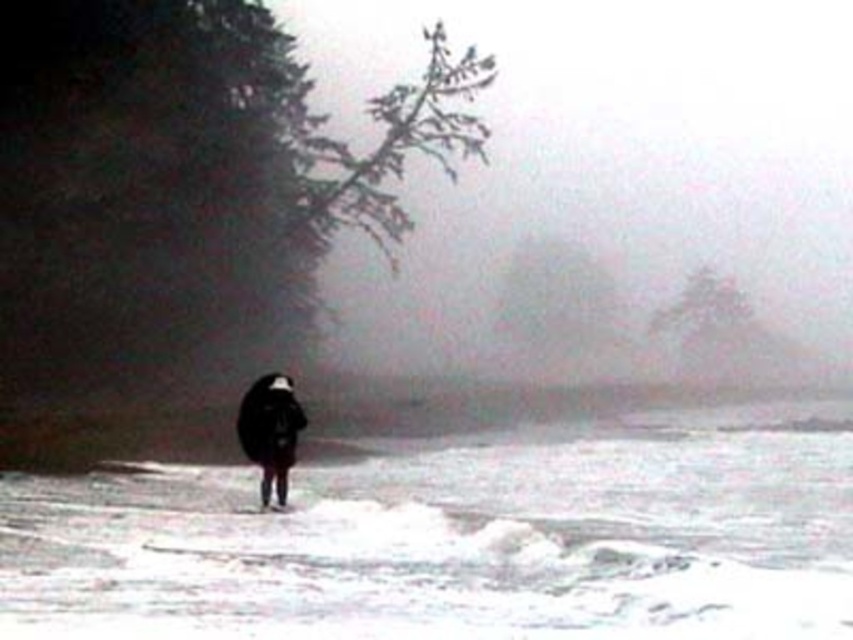
Question: Which object appears farthest from the camera in this image?

Choices:
 (A) black matte coat at center
 (B) white frothy water at center

Answer: (A)

Question: Which object is closer to the camera taking this photo?

Choices:
 (A) white frothy water at center
 (B) black matte coat at center

Answer: (A)

Question: Is white frothy water at center above black matte coat at center?

Choices:
 (A) no
 (B) yes

Answer: (A)

Question: Is white frothy water at center closer to camera compared to black matte coat at center?

Choices:
 (A) yes
 (B) no

Answer: (A)

Question: Observing the image, what is the correct spatial positioning of white frothy water at center in reference to black matte coat at center?

Choices:
 (A) below
 (B) above

Answer: (A)